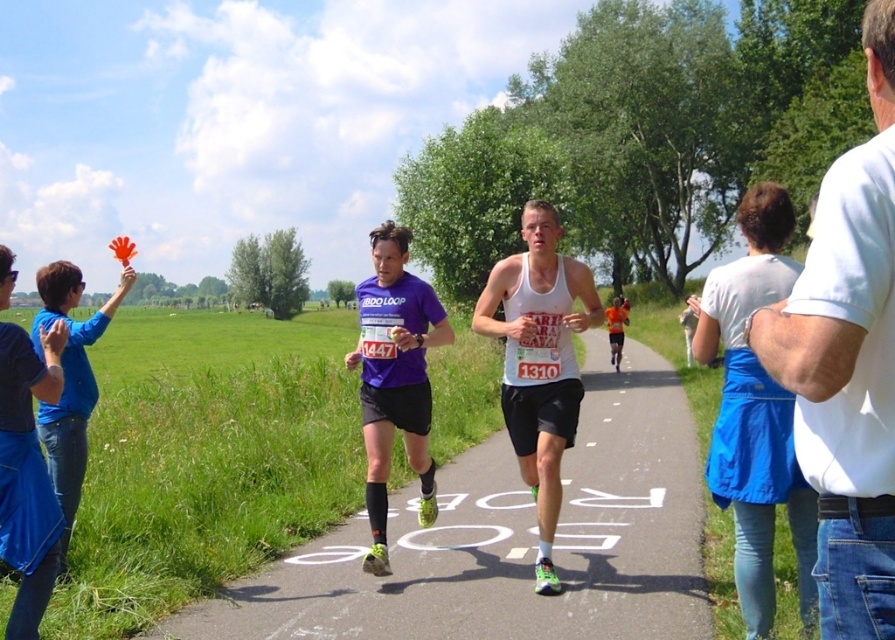
You are a photographer positioned at the starting line of the marathon. You want to capture a photo that includes both the asphalt road at center and the matte purple shirt at center. Considering their sizes, which object should you frame larger in your camera viewfinder to ensure both are clearly visible?

Since the asphalt road at center is wider than the matte purple shirt at center, you should frame the asphalt road at center larger in the viewfinder to accommodate its greater width while still including the matte purple shirt at center.

You are a photographer standing at the center of the image. You want to take a photo of the white cotton shirt at right. Which direction should you move to get a better shot?

Since the white cotton shirt at right is located at point (847,362), you should move to the right and slightly upwards to center it in your frame.